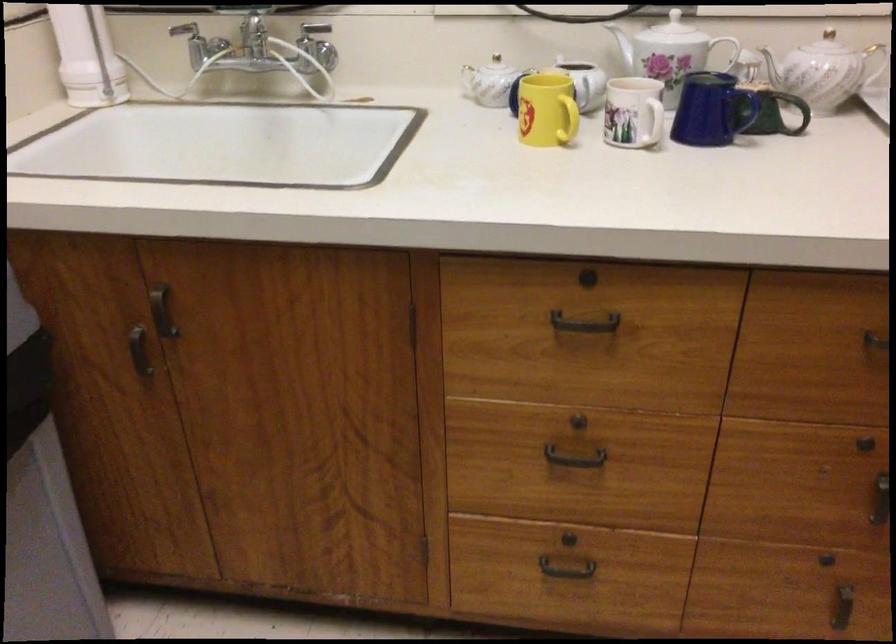
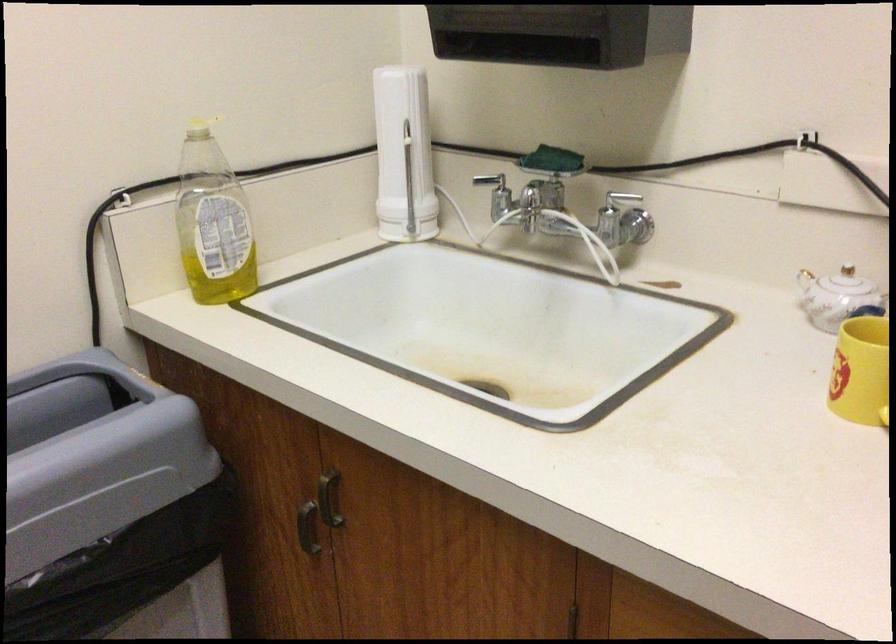
Where in the second image is the point corresponding to point 416,321 from the first image?

(576, 623)